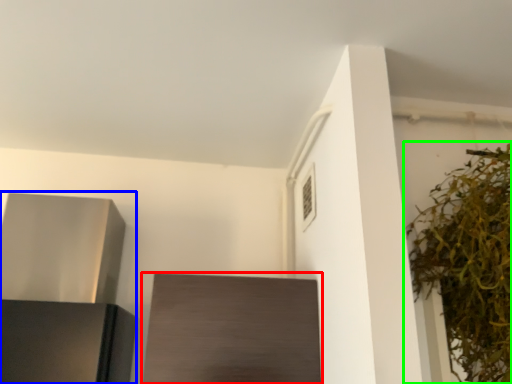
Question: Which object is the closest to the cabinetry (highlighted by a red box)? Choose among these: appliance (highlighted by a blue box) or houseplant (highlighted by a green box).

Choices:
 (A) appliance
 (B) houseplant

Answer: (A)